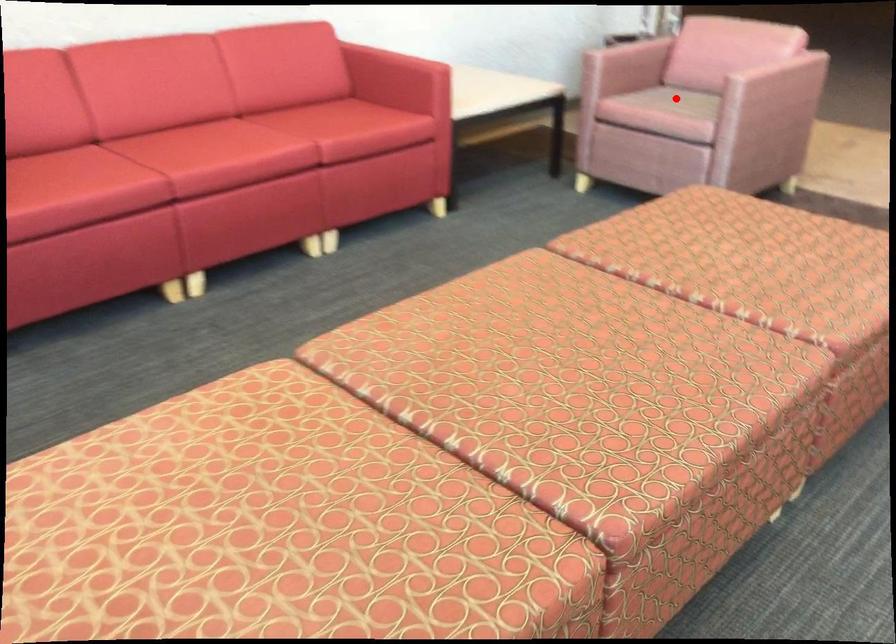
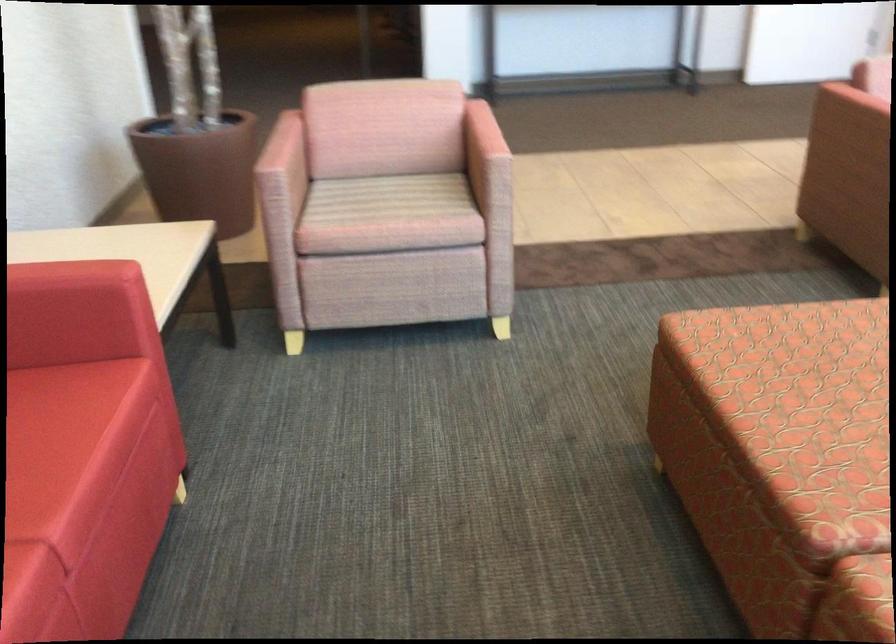
Question: I am providing you with two images of the same scene from different viewpoints. In image1, a red point is highlighted. Considering the same 3D point in image2, which of the following is correct?

Choices:
 (A) It is closer
 (B) It is farther

Answer: (A)